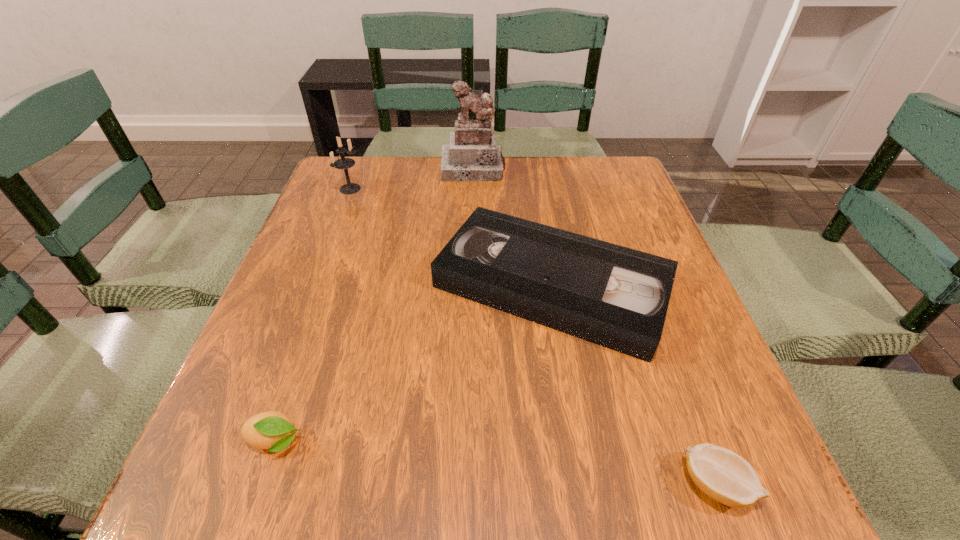
At what (x,y) coordinates should I click in order to perform the action: click on free space at the far edge of the desktop. Please return your answer as a coordinate pair (x, y). The image size is (960, 540). Looking at the image, I should click on (404, 188).

I want to click on vacant space at the near edge, so click(497, 482).

The height and width of the screenshot is (540, 960). I want to click on free location at the left edge, so click(239, 408).

You are a GUI agent. You are given a task and a screenshot of the screen. Output one action in this format:
    pyautogui.click(x=<x>, y=<y>)
    Task: Click on the free space at the right edge of the desktop
    
    Given the screenshot: What is the action you would take?
    pyautogui.click(x=643, y=223)

Locate an element on the screen. The image size is (960, 540). free space at the far left corner is located at coordinates [x=329, y=186].

Image resolution: width=960 pixels, height=540 pixels. I want to click on free space at the near left corner of the desktop, so click(169, 518).

Find the location of a particular element. This screenshot has width=960, height=540. vacant space at the far right corner of the desktop is located at coordinates click(x=591, y=164).

The height and width of the screenshot is (540, 960). What are the coordinates of `vacant region between the shortest object and the taller lemon` in the screenshot? It's located at (495, 463).

You are a GUI agent. You are given a task and a screenshot of the screen. Output one action in this format:
    pyautogui.click(x=<x>, y=<y>)
    Task: Click on the vacant space that is in between the candle holder and the right lemon
    The width and height of the screenshot is (960, 540).
    Given the screenshot: What is the action you would take?
    pyautogui.click(x=533, y=336)

At what (x,y) coordinates should I click in order to perform the action: click on free space that is in between the figurine and the second tallest object. Please return your answer as a coordinate pair (x, y). Looking at the image, I should click on (412, 179).